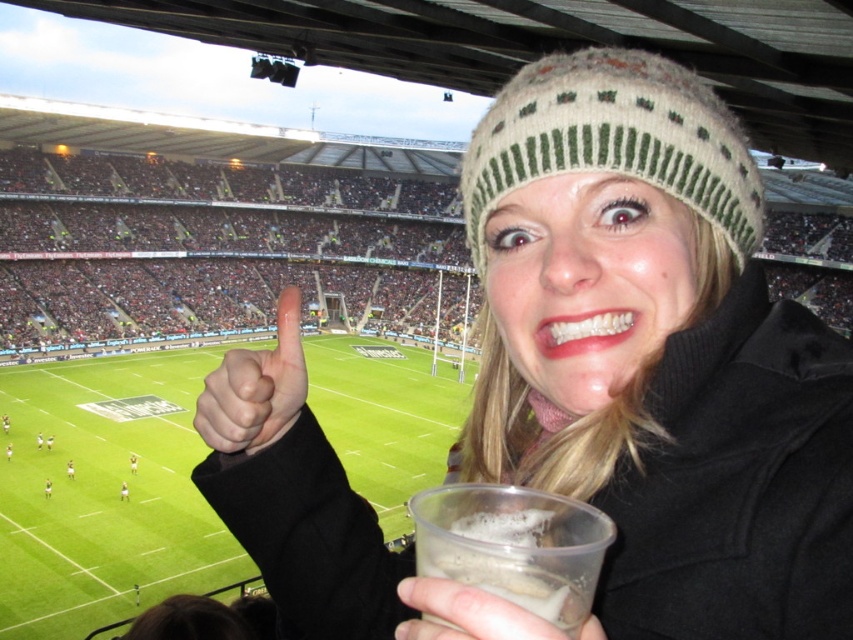
Question: Can you confirm if green grass football field at center is wider than white matte hand at center?

Choices:
 (A) yes
 (B) no

Answer: (A)

Question: Is green grass football field at center to the left of white matte hand at center from the viewer's perspective?

Choices:
 (A) no
 (B) yes

Answer: (B)

Question: Can you confirm if white knit hat at upper center is positioned to the right of translucent plastic cup at lower center?

Choices:
 (A) yes
 (B) no

Answer: (B)

Question: Among these objects, which one is nearest to the camera?

Choices:
 (A) green grass football field at center
 (B) white knit hat at upper center
 (C) knitted woolen hat at upper center

Answer: (B)

Question: Which of the following is the closest to the observer?

Choices:
 (A) (347, 371)
 (B) (593, 561)
 (C) (555, 116)

Answer: (B)

Question: Among these points, which one is nearest to the camera?

Choices:
 (A) (196, 426)
 (B) (503, 524)
 (C) (662, 97)
 (D) (248, 355)

Answer: (B)